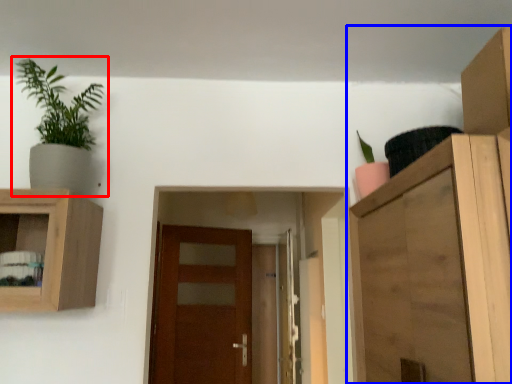
Question: Which object is closer to the camera taking this photo, houseplant (highlighted by a red box) or cupboard (highlighted by a blue box)?

Choices:
 (A) houseplant
 (B) cupboard

Answer: (B)